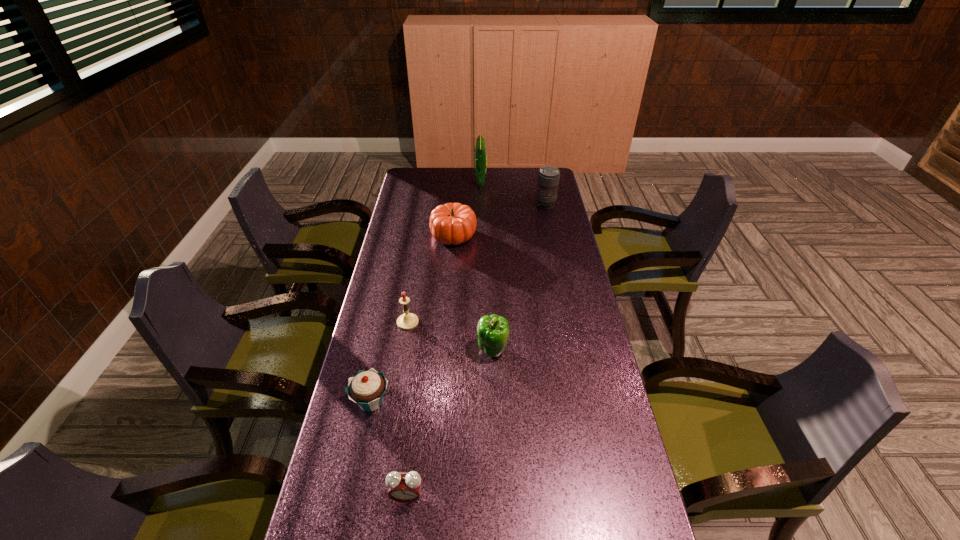
The image size is (960, 540). Find the location of `vacant space located 0.310m on the front-facing side of the farthest object`. vacant space located 0.310m on the front-facing side of the farthest object is located at coordinates (412, 182).

Locate an element on the screen. vacant point located 0.120m on the front-facing side of the farthest object is located at coordinates (450, 182).

The height and width of the screenshot is (540, 960). I want to click on vacant space situated on the side of the rightmost object where the control switches are located, so click(x=554, y=242).

Locate an element on the screen. This screenshot has height=540, width=960. vacant area situated 0.140m on the left of the fifth farthest object is located at coordinates (432, 350).

Where is `vacant space situated 0.310m on the right of the pumpkin`? The width and height of the screenshot is (960, 540). vacant space situated 0.310m on the right of the pumpkin is located at coordinates (551, 235).

This screenshot has width=960, height=540. What are the coordinates of `blank area located on the right of the candle` in the screenshot? It's located at (536, 322).

The image size is (960, 540). I want to click on free location located 0.330m on the back of the cupcake, so click(x=392, y=305).

Image resolution: width=960 pixels, height=540 pixels. I want to click on vacant space located on the clock face of the nearest object, so click(402, 534).

I want to click on object located in the far edge section of the desktop, so click(x=480, y=150).

Locate an element on the screen. candle present at the left edge is located at coordinates (407, 321).